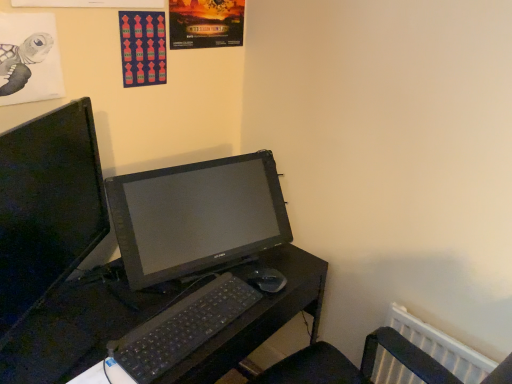
The height and width of the screenshot is (384, 512). What are the coordinates of `vacant space situated on the left part of black plastic keyboard at center` in the screenshot? It's located at (106, 304).